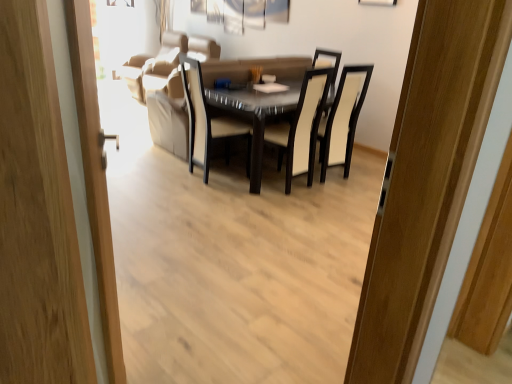
This screenshot has width=512, height=384. Identify the location of vacant space in front of glossy glass table at center. (293, 220).